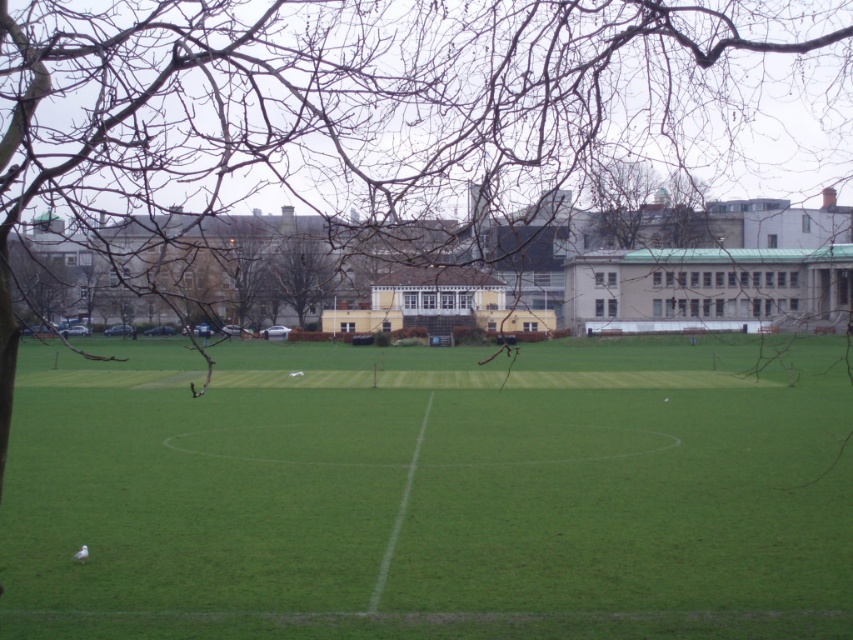
Between green grass field at center and brown leafless tree at center, which one appears on the left side from the viewer's perspective?

Positioned to the left is brown leafless tree at center.

Can you confirm if green grass field at center is thinner than brown leafless tree at center?

Incorrect, green grass field at center's width is not less than brown leafless tree at center's.

Between point (480, 444) and point (274, 310), which one is positioned behind?

Positioned behind is point (274, 310).

Locate an element on the screen. green grass field at center is located at coordinates (428, 493).